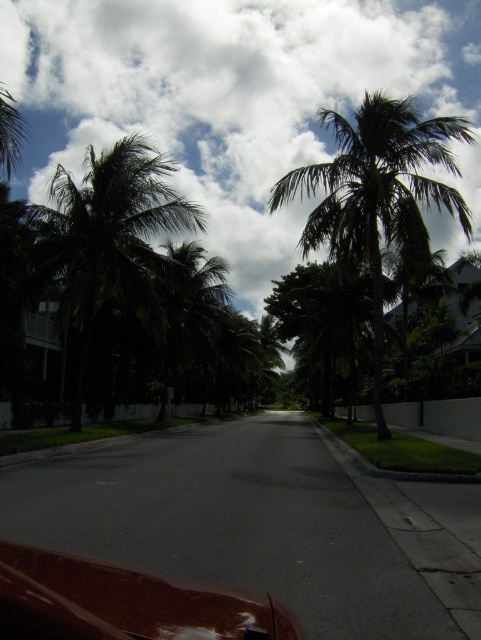
Is green leafy palm tree at center shorter than green leafy palm tree at upper left?

No, green leafy palm tree at center is not shorter than green leafy palm tree at upper left.

Does green leafy palm tree at center have a larger size compared to green leafy palm tree at upper left?

Correct, green leafy palm tree at center is larger in size than green leafy palm tree at upper left.

Is point (356, 188) closer to viewer compared to point (160, 182)?

That is True.

Where is `green leafy palm tree at center`? This screenshot has height=640, width=481. green leafy palm tree at center is located at coordinates (379, 195).

Locate an element on the screen. This screenshot has height=640, width=481. green leafy palm tree at center is located at coordinates (379, 195).

Which of these two, green leafy palm tree at center or glossy brown car at lower left, stands taller?

With more height is green leafy palm tree at center.

Locate an element on the screen. This screenshot has width=481, height=640. green leafy palm tree at center is located at coordinates (379, 195).

The image size is (481, 640). In order to click on green leafy palm tree at center in this screenshot , I will do `click(379, 195)`.

Who is lower down, white fluffy cloud at upper center or green leafy palm tree at upper left?

green leafy palm tree at upper left

Who is higher up, white fluffy cloud at upper center or green leafy palm tree at upper left?

white fluffy cloud at upper center is higher up.

Where is `white fluffy cloud at upper center`? Image resolution: width=481 pixels, height=640 pixels. white fluffy cloud at upper center is located at coordinates (231, 97).